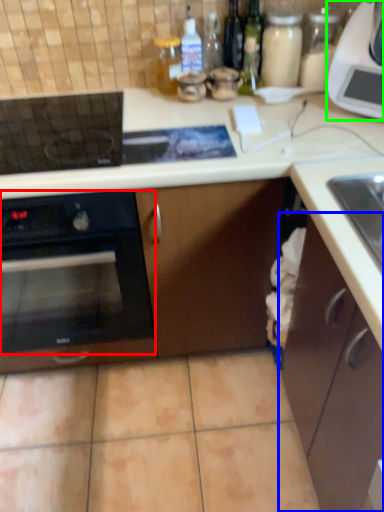
Question: Estimate the real-world distances between objects in this image. Which object is closer to oven (highlighted by a red box), cabinetry (highlighted by a blue box) or kitchen appliance (highlighted by a green box)?

Choices:
 (A) cabinetry
 (B) kitchen appliance

Answer: (A)